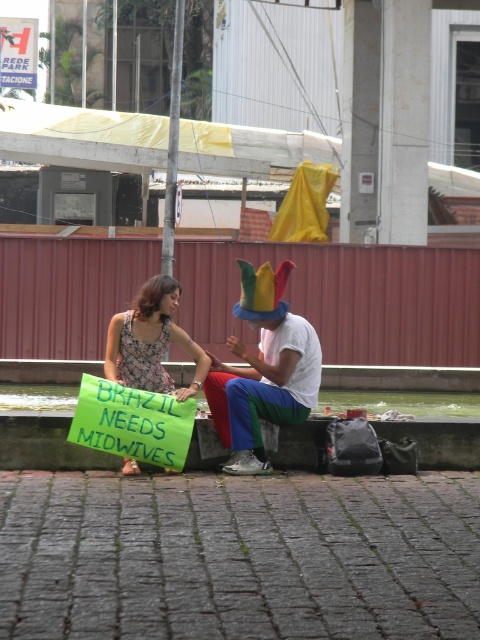
You are standing at the edge of the canal and want to place a 1.2 meter long wooden bench on the green concrete curb at lower center. Can the bench fit on the curb?

The green concrete curb at lower center is 8.72 meters from viewer. The bench is 1.2 meters long. Since the curb is much longer than the bench, the bench can fit on the curb.

You are a photographer taking a picture of the multicolored fabric hat at center and the brick pavement at lower center. Which object will appear larger in the photo?

The multicolored fabric hat at center will appear larger in the photo because it is closer to the viewer than the brick pavement at lower center.